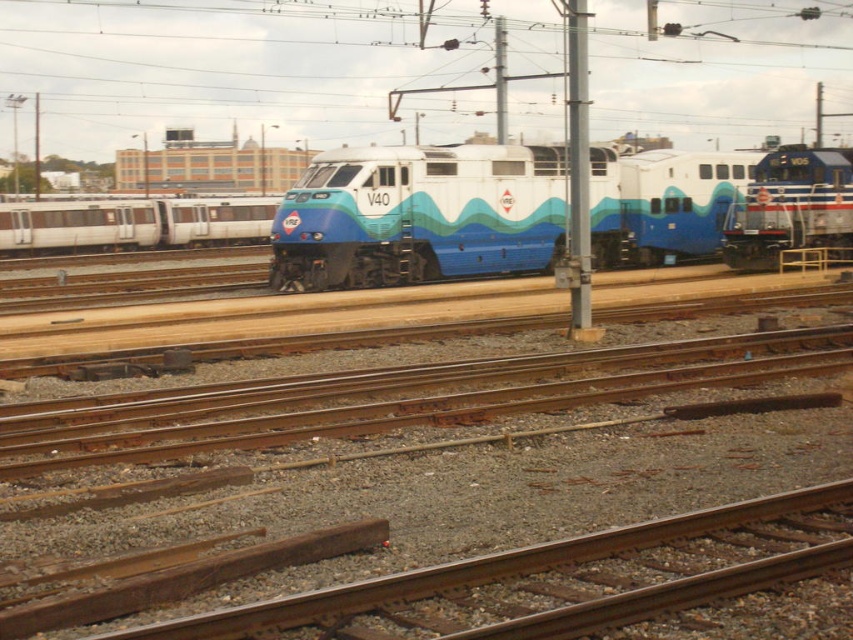
Which is more to the right, silver metallic train car at left or blue glossy locomotive at right?

blue glossy locomotive at right

Is silver metallic train car at left above blue glossy locomotive at right?

Yes, silver metallic train car at left is above blue glossy locomotive at right.

What do you see at coordinates (132, 221) in the screenshot?
I see `silver metallic train car at left` at bounding box center [132, 221].

This screenshot has width=853, height=640. In order to click on silver metallic train car at left in this screenshot , I will do `click(132, 221)`.

Between matte blue train at center and blue glossy locomotive at right, which one is positioned higher?

blue glossy locomotive at right

Which is below, matte blue train at center or blue glossy locomotive at right?

Positioned lower is matte blue train at center.

The image size is (853, 640). Describe the element at coordinates (421, 216) in the screenshot. I see `matte blue train at center` at that location.

Where is `matte blue train at center`? matte blue train at center is located at coordinates (421, 216).

Can you confirm if rusty metal track at center is shorter than blue glossy locomotive at right?

Indeed, rusty metal track at center has a lesser height compared to blue glossy locomotive at right.

Does point (514, 356) come closer to viewer compared to point (782, 205)?

That is True.

I want to click on rusty metal track at center, so click(397, 397).